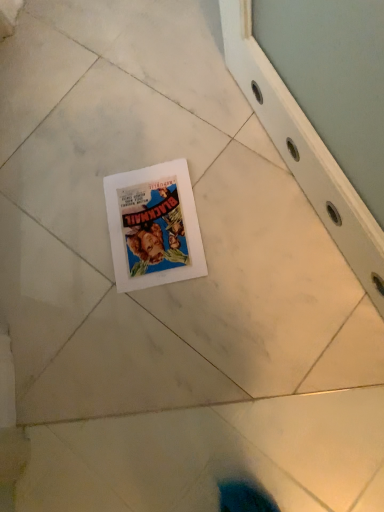
Identify the location of free space to the left of matte paper comic book at center. This screenshot has height=512, width=384. (66, 272).